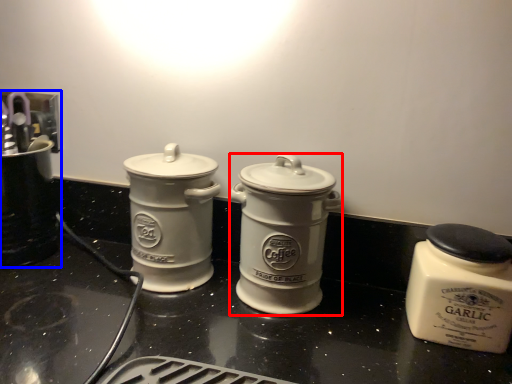
Question: Which object is closer to the camera taking this photo, kitchen appliance (highlighted by a red box) or appliance (highlighted by a blue box)?

Choices:
 (A) kitchen appliance
 (B) appliance

Answer: (A)